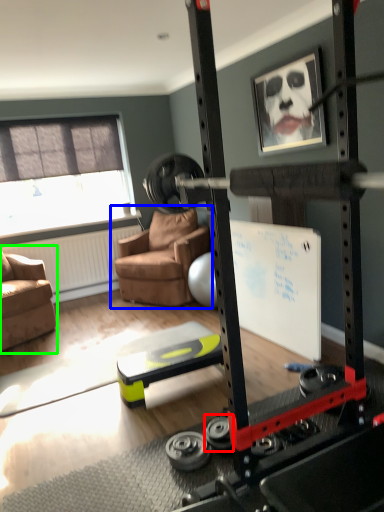
Question: Considering the real-world distances, which object is farthest from wheel (highlighted by a red box)? chair (highlighted by a blue box) or chair (highlighted by a green box)?

Choices:
 (A) chair
 (B) chair

Answer: (A)